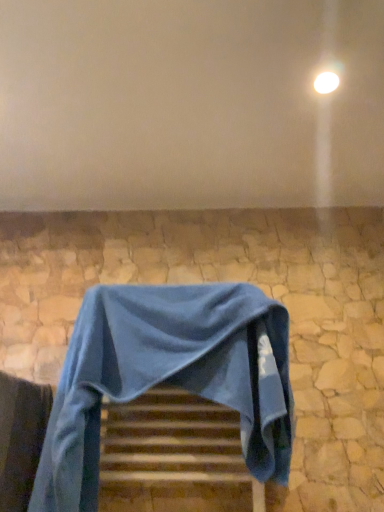
Question: Can you confirm if matte white wall at upper center is thinner than blue fabric chair at center?

Choices:
 (A) no
 (B) yes

Answer: (A)

Question: Is matte white wall at upper center looking in the opposite direction of blue fabric chair at center?

Choices:
 (A) no
 (B) yes

Answer: (A)

Question: Does matte white wall at upper center have a greater width compared to blue fabric chair at center?

Choices:
 (A) no
 (B) yes

Answer: (B)

Question: Is matte white wall at upper center not within blue fabric chair at center?

Choices:
 (A) no
 (B) yes

Answer: (B)

Question: Is matte white wall at upper center behind blue fabric chair at center?

Choices:
 (A) no
 (B) yes

Answer: (A)

Question: From a real-world perspective, is matte white wall at upper center beneath blue fabric chair at center?

Choices:
 (A) no
 (B) yes

Answer: (A)

Question: Is white glossy light at upper right at the right side of matte white wall at upper center?

Choices:
 (A) yes
 (B) no

Answer: (A)

Question: Could you tell me if white glossy light at upper right is facing matte white wall at upper center?

Choices:
 (A) yes
 (B) no

Answer: (A)

Question: Considering the relative sizes of white glossy light at upper right and matte white wall at upper center in the image provided, is white glossy light at upper right thinner than matte white wall at upper center?

Choices:
 (A) yes
 (B) no

Answer: (A)

Question: From the image's perspective, is white glossy light at upper right on matte white wall at upper center?

Choices:
 (A) no
 (B) yes

Answer: (B)

Question: Can you confirm if white glossy light at upper right is bigger than matte white wall at upper center?

Choices:
 (A) yes
 (B) no

Answer: (B)

Question: Is white glossy light at upper right closer to camera compared to matte white wall at upper center?

Choices:
 (A) yes
 (B) no

Answer: (B)

Question: Can you confirm if matte white wall at upper center is wider than white glossy light at upper right?

Choices:
 (A) yes
 (B) no

Answer: (A)